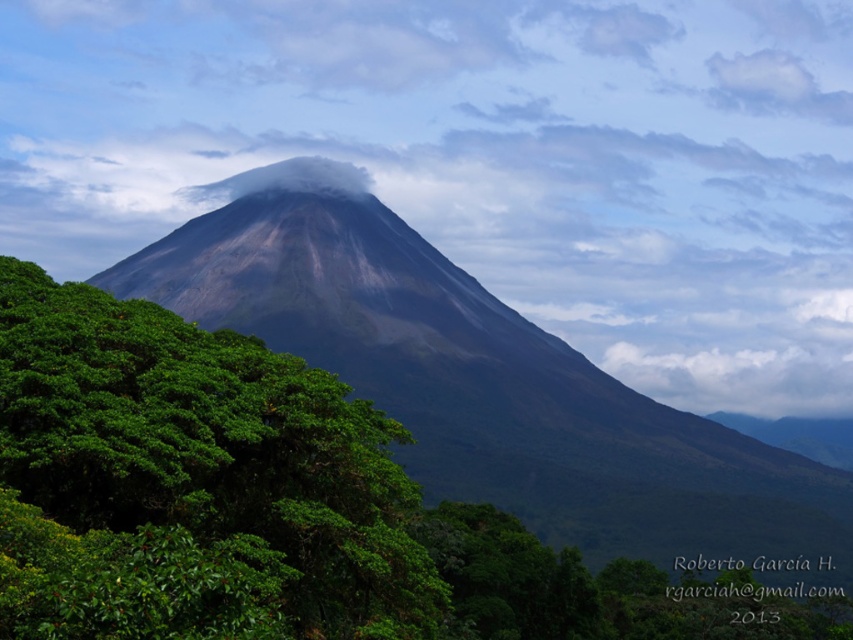
Is green leafy tree at left bigger than volcanic rock mountain at center?

Incorrect, green leafy tree at left is not larger than volcanic rock mountain at center.

Which is in front, point (271, 547) or point (447, 292)?

Point (271, 547) is in front.

Does point (231, 394) come in front of point (630, 401)?

That is True.

The image size is (853, 640). I want to click on green leafy tree at left, so click(x=190, y=483).

Does white fluffy cloud at upper center lie in front of green leafy tree at left?

That is False.

Is point (90, 67) in front of point (67, 412)?

No.

Identify the location of white fluffy cloud at upper center. (485, 160).

Is white fluffy cloud at upper center wider than volcanic rock mountain at center?

Indeed, white fluffy cloud at upper center has a greater width compared to volcanic rock mountain at center.

Does white fluffy cloud at upper center have a lesser height compared to volcanic rock mountain at center?

No.

I want to click on white fluffy cloud at upper center, so click(x=485, y=160).